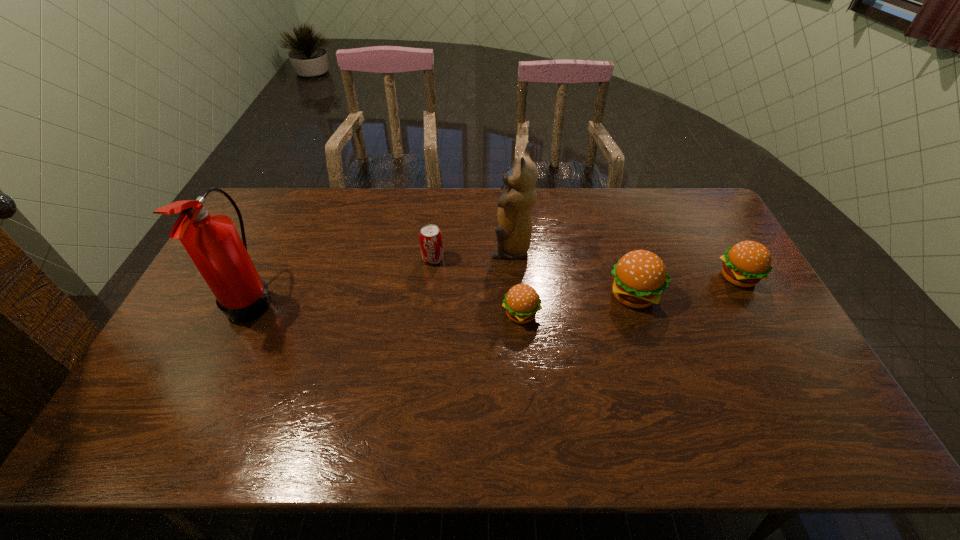
In order to click on vacant area that lies between the tallest hamburger and the soda in this screenshot , I will do `click(534, 277)`.

Image resolution: width=960 pixels, height=540 pixels. I want to click on free space between the fire extinguisher and the rightmost hamburger, so click(494, 288).

Where is `object that is the third closest one to the fire extinguisher`? object that is the third closest one to the fire extinguisher is located at coordinates point(522,302).

You are a GUI agent. You are given a task and a screenshot of the screen. Output one action in this format:
    pyautogui.click(x=<x>, y=<y>)
    Task: Click on the object that stands as the closest to the rightmost hamburger
    This screenshot has width=960, height=540.
    Given the screenshot: What is the action you would take?
    pyautogui.click(x=639, y=277)

Identify the location of hamburger object that ranks as the closest to the soda. (522, 302).

Locate an element on the screen. The height and width of the screenshot is (540, 960). hamburger that is the third closest one to the leftmost object is located at coordinates point(746,263).

You are a GUI agent. You are given a task and a screenshot of the screen. Output one action in this format:
    pyautogui.click(x=<x>, y=<y>)
    Task: Click on the vacant position in the image that satisfies the following two spatial constraints: 1. on the back side of the fifth object from left to right; 2. on the face of the cat
    Image resolution: width=960 pixels, height=540 pixels.
    Given the screenshot: What is the action you would take?
    pyautogui.click(x=618, y=248)

This screenshot has height=540, width=960. I want to click on vacant space that satisfies the following two spatial constraints: 1. on the front side of the fifth object from left to right; 2. at the spray nozzle of the leftmost object, so click(x=635, y=299).

Locate an element on the screen. free space that satisfies the following two spatial constraints: 1. on the front side of the rightmost object; 2. at the spray nozzle of the leftmost object is located at coordinates (750, 299).

This screenshot has height=540, width=960. In order to click on free space that satisfies the following two spatial constraints: 1. on the face of the cat; 2. on the left side of the rightmost object in this screenshot , I will do [x=513, y=277].